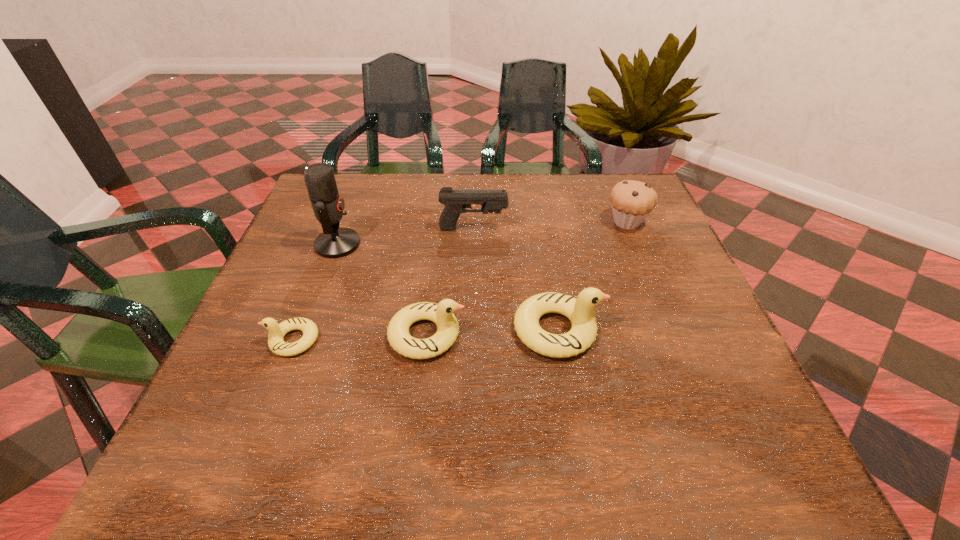
Locate an element on the screen. Image resolution: width=960 pixels, height=540 pixels. vacant region between the tallest object and the rightmost object is located at coordinates click(x=482, y=233).

The width and height of the screenshot is (960, 540). Find the location of `vacant region between the pistol and the second tallest duckling`. vacant region between the pistol and the second tallest duckling is located at coordinates (450, 282).

Identify the location of unoccupied position between the shortest duckling and the second shortest object. (360, 338).

What are the coordinates of `free space between the pistol and the second shortest duckling` in the screenshot? It's located at (450, 282).

Locate an element on the screen. The image size is (960, 540). free area in between the leftmost duckling and the rightmost duckling is located at coordinates (425, 335).

The height and width of the screenshot is (540, 960). Identify the location of empty space between the pistol and the microphone. (405, 237).

In order to click on object that is the third closest to the rightmost object in this screenshot , I will do `click(442, 314)`.

Identify which object is the second closest to the second duckling from right to left. Please provide its 2D coordinates. Your answer should be formatted as a tuple, i.e. [(x, y)], where the tuple contains the x and y coordinates of a point satisfying the conditions above.

[(276, 333)]

Locate an element on the screen. the closest duckling relative to the tallest object is located at coordinates (442, 314).

Locate which duckling ranks in proximity to the tallest object. Please provide its 2D coordinates. Your answer should be formatted as a tuple, i.e. [(x, y)], where the tuple contains the x and y coordinates of a point satisfying the conditions above.

[(442, 314)]